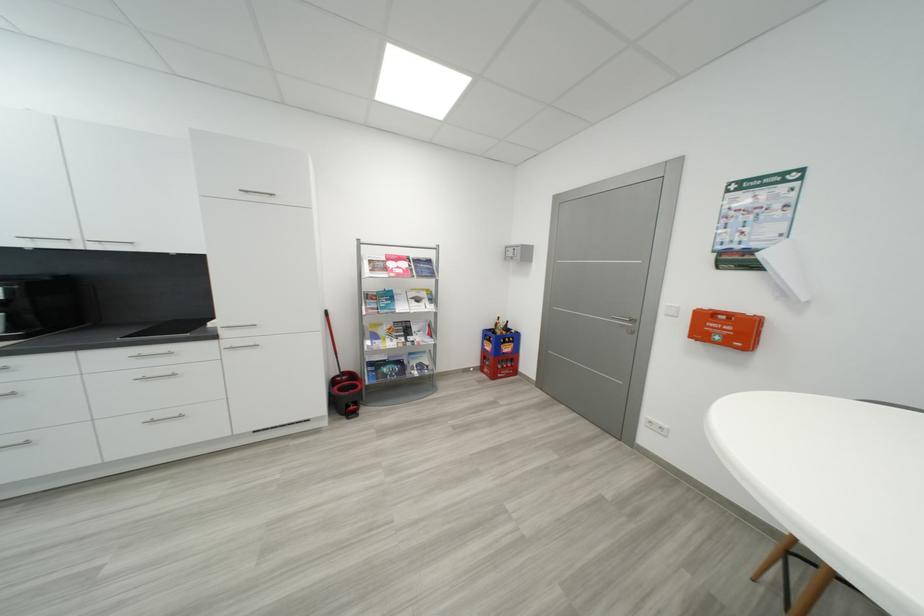
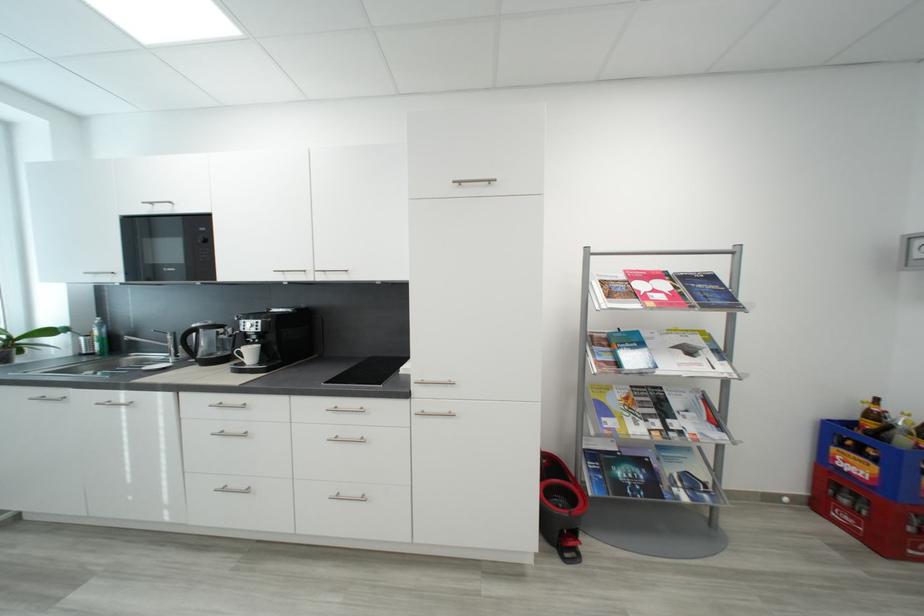
Find the pixel in the second image that matches (x=495, y=342) in the first image.

(867, 454)